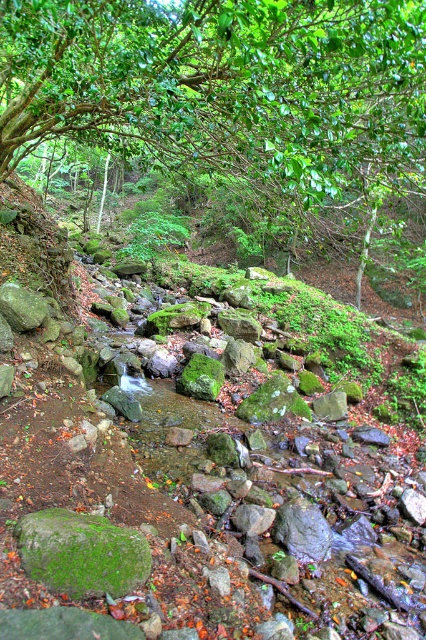
Question: Does green leafy tree at upper center appear on the right side of green mossy rock at center?

Choices:
 (A) no
 (B) yes

Answer: (A)

Question: Which point is closer to the camera?

Choices:
 (A) green leafy tree at upper center
 (B) green mossy rock at center

Answer: (B)

Question: Which object appears farthest from the camera in this image?

Choices:
 (A) green mossy rock at center
 (B) green leafy tree at upper center

Answer: (B)

Question: Can you confirm if green leafy tree at upper center is bigger than green mossy rock at center?

Choices:
 (A) yes
 (B) no

Answer: (B)

Question: Is the position of green leafy tree at upper center more distant than that of green mossy rock at center?

Choices:
 (A) no
 (B) yes

Answer: (B)